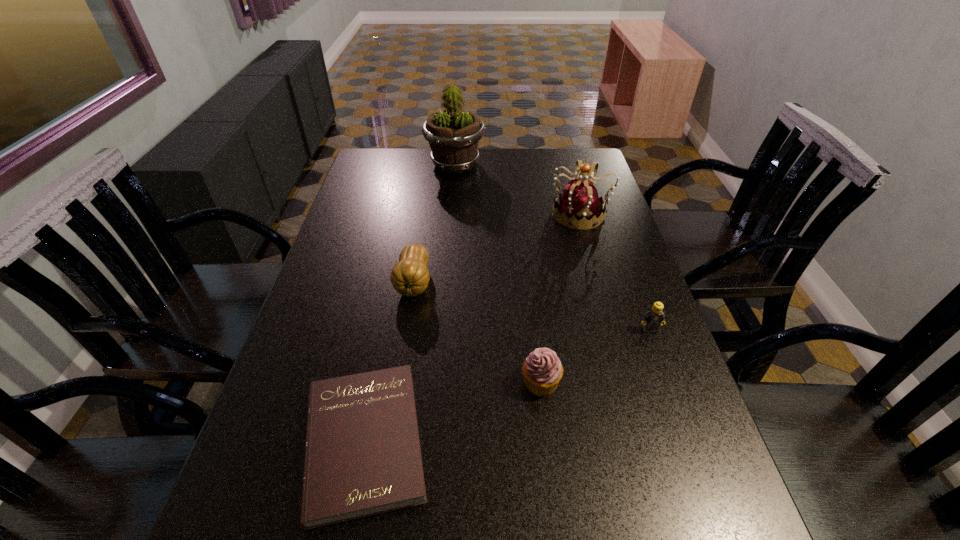
Where is `free space between the fifth nearest object and the cupcake`? free space between the fifth nearest object and the cupcake is located at coordinates (561, 298).

In order to click on vacant space that is in between the fourth farthest object and the second farthest object in this screenshot , I will do `click(615, 272)`.

The image size is (960, 540). Identify the location of unoccupied position between the fourth farthest object and the fourth object from left to right. (595, 356).

This screenshot has width=960, height=540. I want to click on object that is the fifth closest to the cupcake, so click(x=453, y=135).

You are a GUI agent. You are given a task and a screenshot of the screen. Output one action in this format:
    pyautogui.click(x=<x>, y=<y>)
    Task: Click on the object identified as the third closest to the cupcake
    
    Given the screenshot: What is the action you would take?
    pyautogui.click(x=410, y=276)

The image size is (960, 540). Identify the location of free space that satisfies the following two spatial constraints: 1. on the front-facing side of the tiara; 2. on the front side of the cupcake. (629, 382).

Image resolution: width=960 pixels, height=540 pixels. I want to click on vacant point that satisfies the following two spatial constraints: 1. on the front-facing side of the second farthest object; 2. on the front side of the hardback book, so click(x=646, y=442).